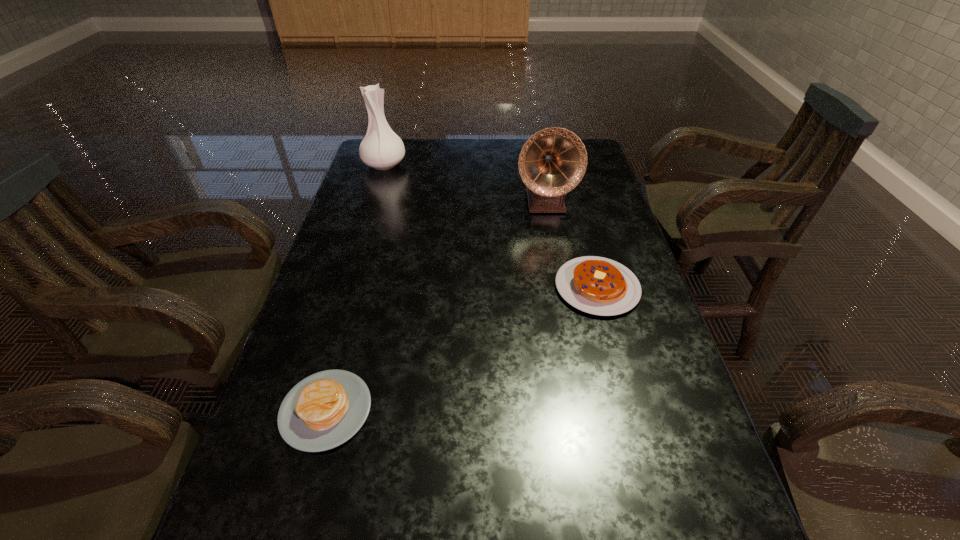
Locate an element on the screen. This screenshot has width=960, height=540. object that stands as the closest to the farther pancake is located at coordinates (552, 162).

Identify the location of free space that satisfies the following two spatial constraints: 1. on the back side of the third farthest object; 2. on the right side of the nearer pancake. This screenshot has width=960, height=540. (360, 287).

Find the location of `vacant space that satisfies the following two spatial constraints: 1. on the horn of the right pancake; 2. on the right side of the phonograph record`. vacant space that satisfies the following two spatial constraints: 1. on the horn of the right pancake; 2. on the right side of the phonograph record is located at coordinates (561, 287).